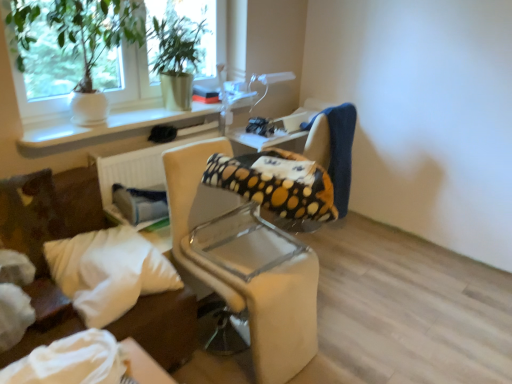
Question: From a real-world perspective, relative to green leafy plant in white pot at upper left, positioned as the 1th houseplant in left-to-right order, is green matte plant at upper left, placed as the 2th houseplant when sorted from left to right, vertically above or below?

Choices:
 (A) below
 (B) above

Answer: (A)

Question: Looking at the image, does green matte plant at upper left, placed as the 2th houseplant when sorted from left to right, seem bigger or smaller compared to green leafy plant in white pot at upper left, positioned as the 1th houseplant in left-to-right order?

Choices:
 (A) big
 (B) small

Answer: (B)

Question: Which is nearer to the green leafy plant in white pot at upper left, positioned as the 1th houseplant in left-to-right order?

Choices:
 (A) white plastic radiator at lower left
 (B) white soft pillow at lower left
 (C) beige fabric chair at center, the 2th chair when ordered from back to front
 (D) green matte plant at upper left, placed as the 2th houseplant when sorted from left to right
 (E) white ceramic vase at upper left

Answer: (E)

Question: Considering the real-world distances, which object is closest to the green matte plant at upper left, which ranks as the 1th houseplant in right-to-left order?

Choices:
 (A) polka dot fabric chair at center, positioned as the 1th chair in back-to-front order
 (B) white ceramic vase at upper left
 (C) white soft pillow at lower left
 (D) beige fabric chair at center, which appears as the 1th chair when viewed from the front
 (E) white plastic radiator at lower left

Answer: (B)